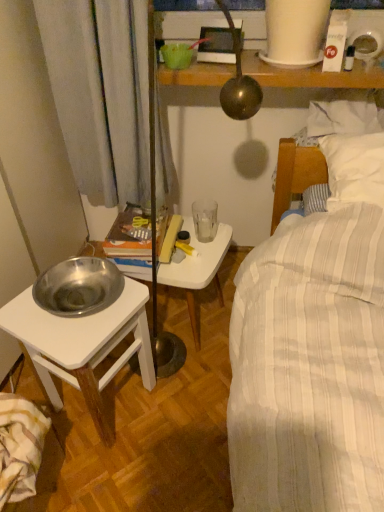
Identify the location of vacant area that is in front of white plastic table at center. (191, 393).